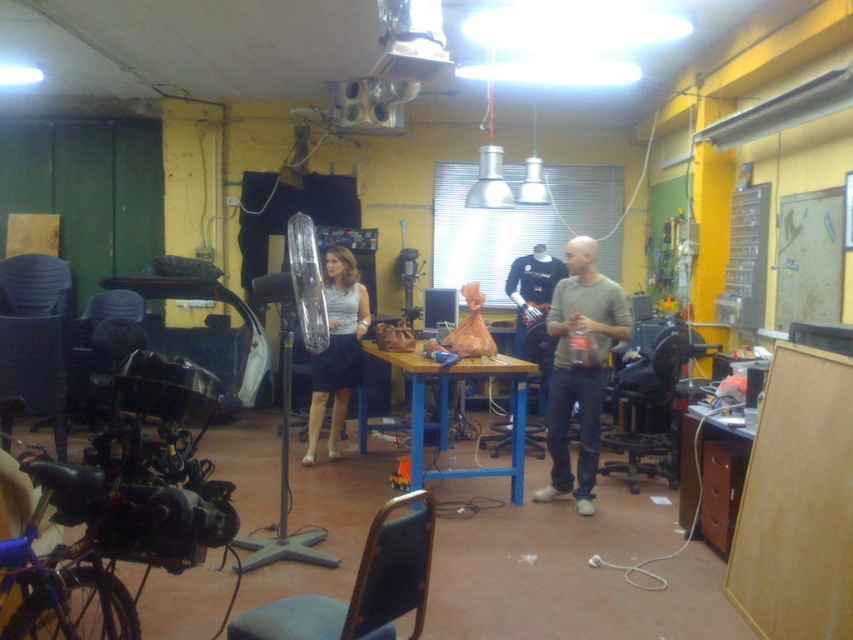
Question: Considering the relative positions of gray cotton shirt at center and wooden table at center in the image provided, where is gray cotton shirt at center located with respect to wooden table at center?

Choices:
 (A) below
 (B) above

Answer: (B)

Question: Which object is positioned farthest from the gray cotton shirt at center?

Choices:
 (A) matte gray skirt at center
 (B) wooden table at center
 (C) wooden desk at lower right

Answer: (A)

Question: Is wooden table at center in front of wooden desk at lower right?

Choices:
 (A) yes
 (B) no

Answer: (B)

Question: Which point is farther to the camera?

Choices:
 (A) (596, 422)
 (B) (511, 460)
 (C) (347, 394)
 (D) (694, 515)

Answer: (C)

Question: Which of the following is the closest to the observer?

Choices:
 (A) (604, 284)
 (B) (331, 374)
 (C) (419, 445)
 (D) (682, 516)

Answer: (D)

Question: Can you confirm if wooden table at center is wider than matte gray skirt at center?

Choices:
 (A) yes
 (B) no

Answer: (A)